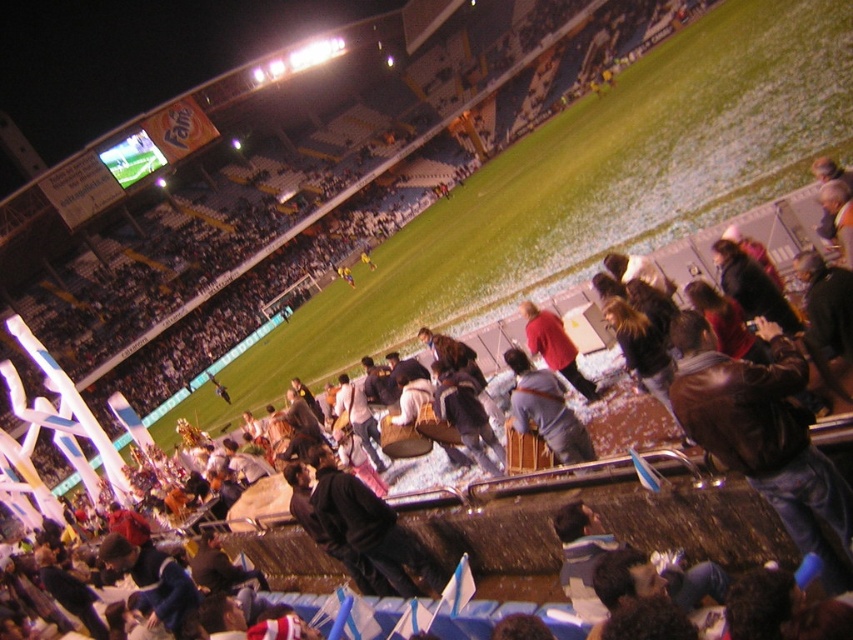
Question: Is gray fabric jacket at center to the left of red matte jacket at center from the viewer's perspective?

Choices:
 (A) yes
 (B) no

Answer: (A)

Question: Which of the following is the farthest from the observer?

Choices:
 (A) (521, 381)
 (B) (563, 340)

Answer: (B)

Question: Which point is closer to the camera taking this photo?

Choices:
 (A) (543, 326)
 (B) (523, 416)

Answer: (B)

Question: Does gray fabric jacket at center appear over red matte jacket at center?

Choices:
 (A) yes
 (B) no

Answer: (B)

Question: Observing the image, what is the correct spatial positioning of gray fabric jacket at center in reference to red matte jacket at center?

Choices:
 (A) right
 (B) left

Answer: (B)